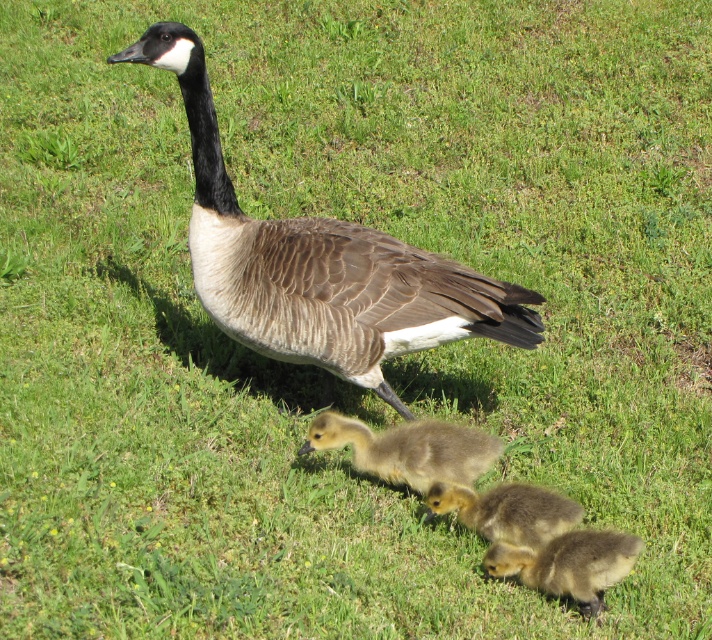
Consider the image. You are a wildlife photographer trying to capture a closeup of the brown fuzzy gosling at center and the soft yellow downy gosling at center. Since you want to focus on one of them, which one would you choose if you want to photograph the larger goose?

The brown fuzzy gosling at center is bigger than the soft yellow downy gosling at center, so you should choose the brown fuzzy gosling at center to photograph the larger goose.